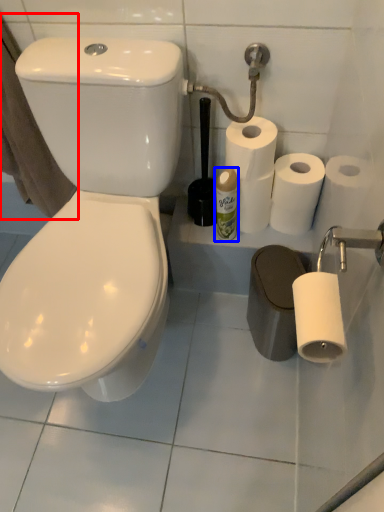
Question: Among these objects, which one is nearest to the camera, bath towel (highlighted by a red box) or cleaning product (highlighted by a blue box)?

Choices:
 (A) bath towel
 (B) cleaning product

Answer: (A)